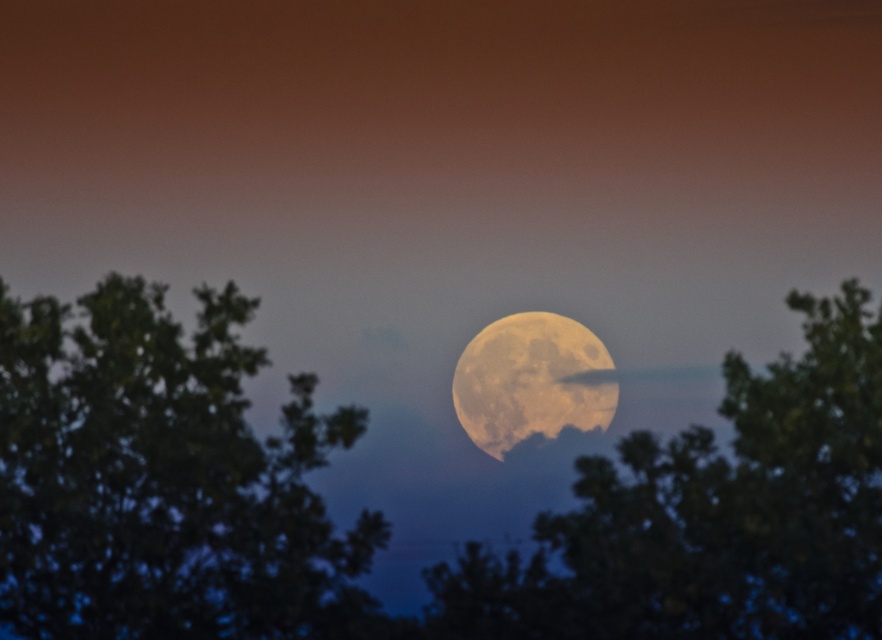
You are an astronomer observing the night sky. You notice the green leafy tree at center and the golden textured moon at center. Which object occupies a larger area in the image?

The green leafy tree at center has a greater width than the golden textured moon at center, so it occupies a larger area in the image.

You are an astronomer observing the night sky and notice the green leafy tree at left and the golden textured moon at center. Which object appears taller in the scene?

The green leafy tree at left is taller than the golden textured moon at center.